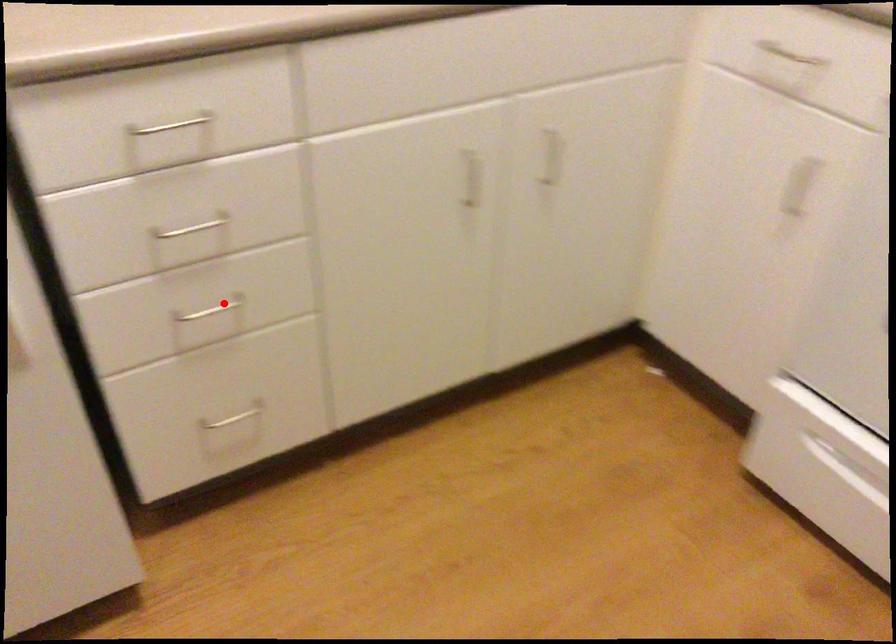
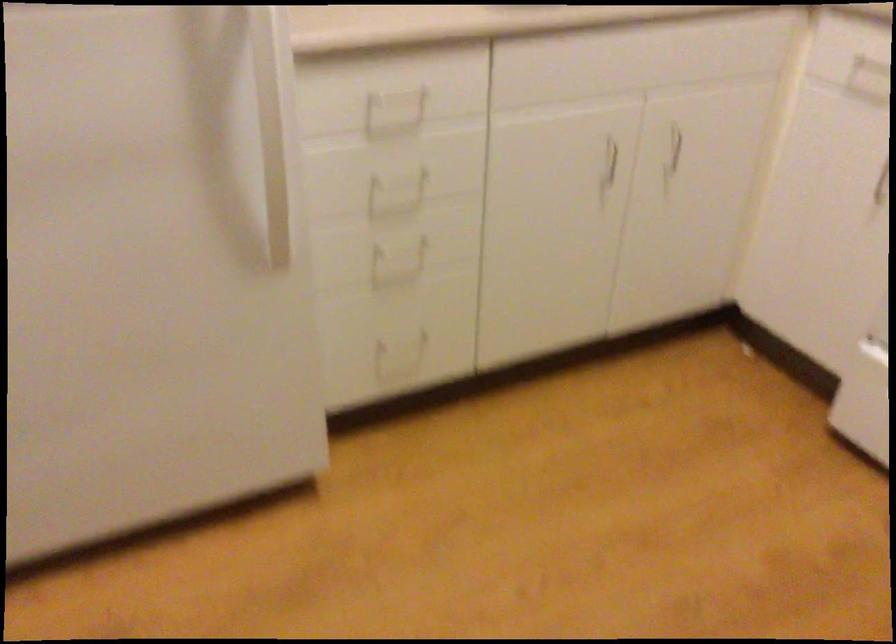
In the second image, find the point that corresponds to the highlighted location in the first image.

(407, 245)